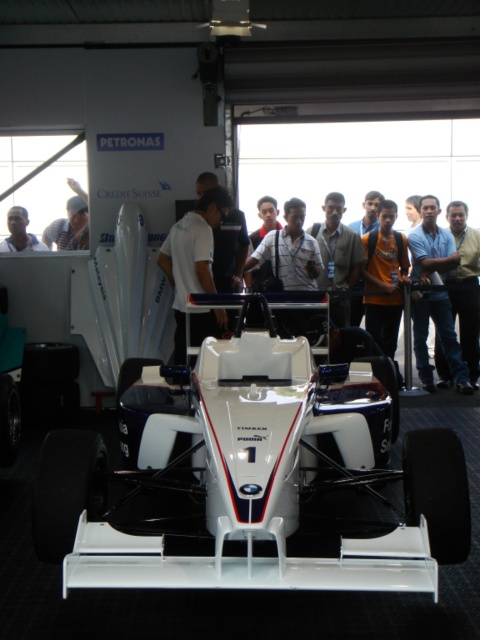
You are a photographer positioned behind the white matte race car at center and want to take a photo of the white matte shirt at center without the car blocking the view. Is this possible?

The white matte race car at center is in front of the white matte shirt at center, so the car will block the view of the shirt. You cannot take a photo of the shirt without the car blocking it.

You are a photographer standing in the garage and want to take a photo of the Formula One race car. However, there are two people blocking your view at the center of the scene. The light brown leather shirt at center and the dark skin smooth face at center. Which object is taller and might be blocking more of the car?

The light brown leather shirt at center is much taller than the dark skin smooth face at center, so it might be blocking more of the car.